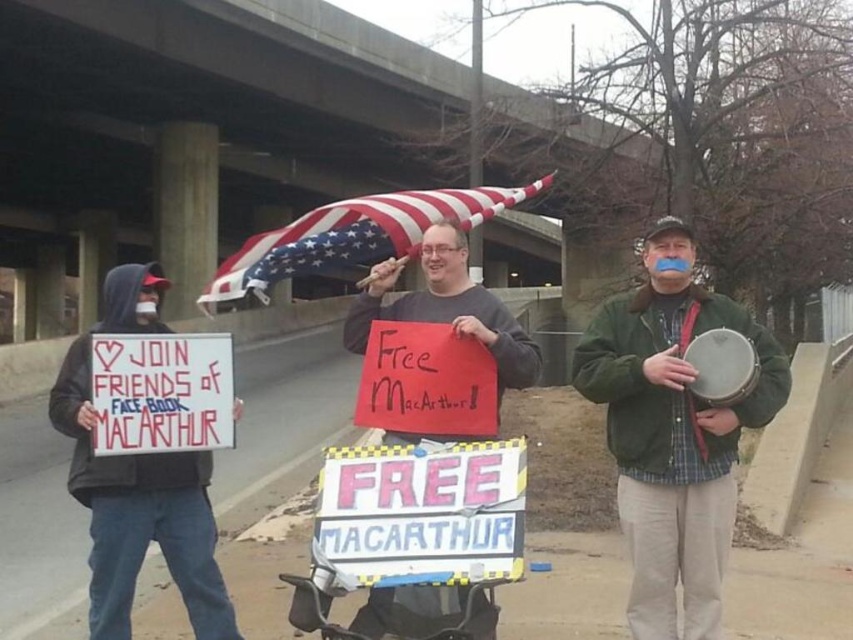
You are a photographer trying to capture both the green fabric drum at center and the american flag at center in the same frame. Based on their sizes in the image, which object should you focus on first to ensure both fit in the frame?

The green fabric drum at center occupies less space than the american flag at center, so you should focus on positioning the larger American flag first to ensure both fit in the frame.

From the picture: You are a photographer aiming to capture a clear shot of both the black hoodie at left and the american flag at center. Based on their positions, which object is lower in the frame?

The black hoodie at left is lower in the frame than the american flag at center.